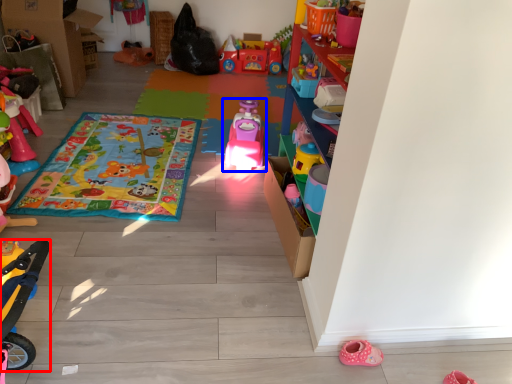
Question: Among these objects, which one is nearest to the camera, toy (highlighted by a red box) or toy (highlighted by a blue box)?

Choices:
 (A) toy
 (B) toy

Answer: (A)